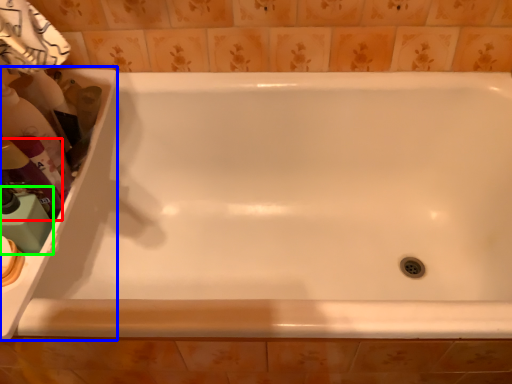
Question: Based on their relative distances, which object is nearer to cleaning product (highlighted by a red box)? Choose from sink (highlighted by a blue box) and cleaning product (highlighted by a green box).

Choices:
 (A) sink
 (B) cleaning product

Answer: (B)